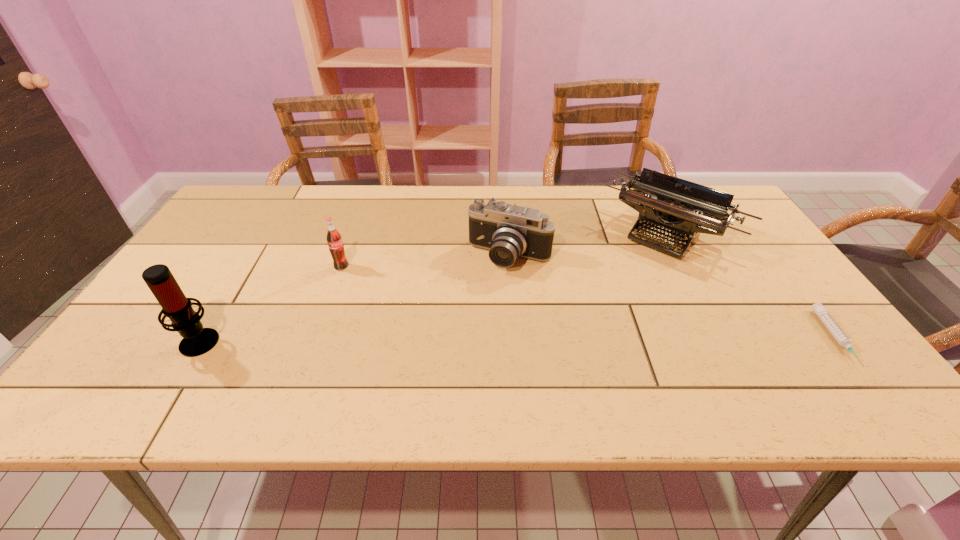
Identify the location of the leftmost object. (197, 340).

Identify the location of microphone. The width and height of the screenshot is (960, 540). (197, 340).

You are a GUI agent. You are given a task and a screenshot of the screen. Output one action in this format:
    pyautogui.click(x=<x>, y=<y>)
    Task: Click on the syringe
    The height and width of the screenshot is (540, 960).
    Given the screenshot: What is the action you would take?
    pyautogui.click(x=821, y=311)

Image resolution: width=960 pixels, height=540 pixels. Identify the location of the shortest object. (821, 311).

This screenshot has height=540, width=960. Identify the location of soda bottle. (334, 240).

Find the location of `typewriter`. typewriter is located at coordinates (681, 208).

You are a GUI agent. You are given a task and a screenshot of the screen. Output one action in this format:
    pyautogui.click(x=<x>, y=<y>)
    Task: Click on the third object from right to left
    The height and width of the screenshot is (540, 960).
    Given the screenshot: What is the action you would take?
    pyautogui.click(x=508, y=231)

Identify the location of free region located 0.130m on the back of the tallest object. The image size is (960, 540). (233, 287).

At what (x,y) coordinates should I click in order to perform the action: click on free space located 0.130m on the label of the soda bottle. Please return your answer as a coordinate pair (x, y). The height and width of the screenshot is (540, 960). Looking at the image, I should click on (376, 292).

What are the coordinates of `blank area located 0.310m on the label of the soda bottle` in the screenshot? It's located at (424, 327).